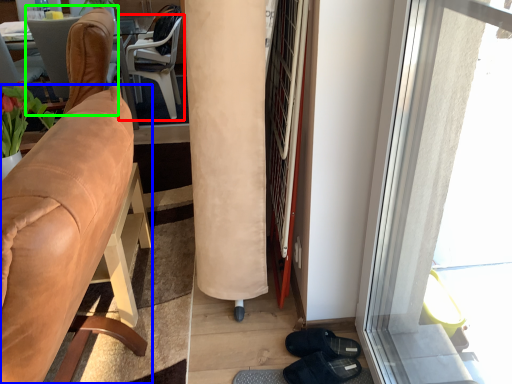
Question: Based on their relative distances, which object is farther from chair (highlighted by a red box)? Choose from chair (highlighted by a blue box) and chair (highlighted by a green box).

Choices:
 (A) chair
 (B) chair

Answer: (A)